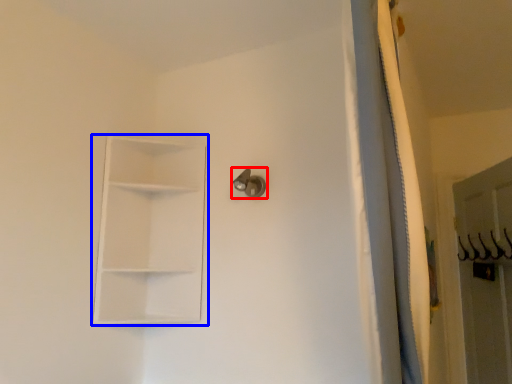
Question: Among these objects, which one is farthest to the camera, door handle (highlighted by a red box) or shelf (highlighted by a blue box)?

Choices:
 (A) door handle
 (B) shelf

Answer: (A)